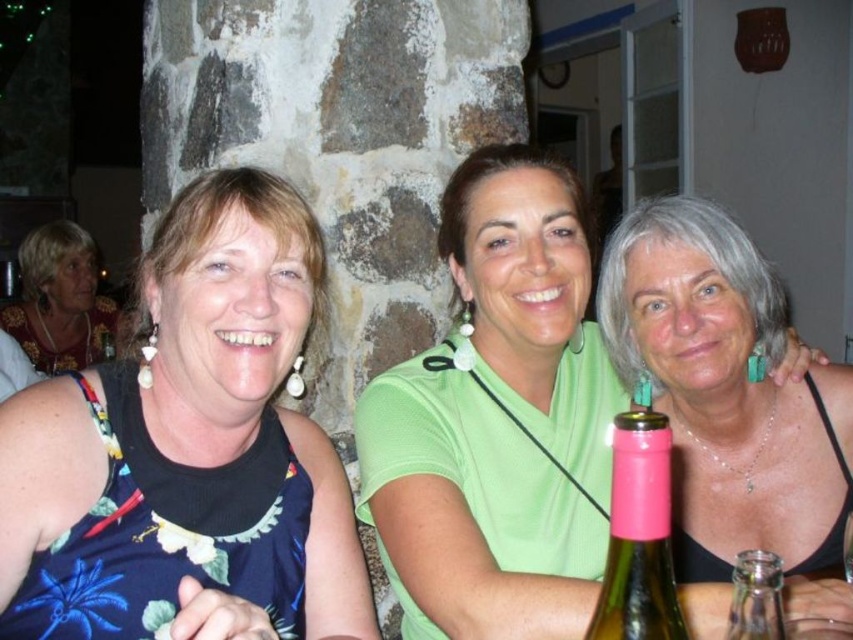
Question: Which point is farther to the camera?

Choices:
 (A) (743, 616)
 (B) (109, 346)
 (C) (764, 465)

Answer: (B)

Question: Which point is farther to the camera?

Choices:
 (A) pink matte bottle at center
 (B) transparent glass bottle at center
 (C) blue floral dress at left
 (D) transparent glass at lower right

Answer: (C)

Question: Does transparent glass bottle at center appear over transparent glass at lower right?

Choices:
 (A) no
 (B) yes

Answer: (B)

Question: Is pink matte bottle at center to the left of transparent glass bottle at center from the viewer's perspective?

Choices:
 (A) no
 (B) yes

Answer: (B)

Question: Does pink matte bottle at center have a smaller size compared to transparent glass at lower right?

Choices:
 (A) yes
 (B) no

Answer: (A)

Question: Among these objects, which one is nearest to the camera?

Choices:
 (A) transparent glass bottle at center
 (B) blue floral dress at left
 (C) green matte shirt at center
 (D) transparent glass at lower right

Answer: (A)